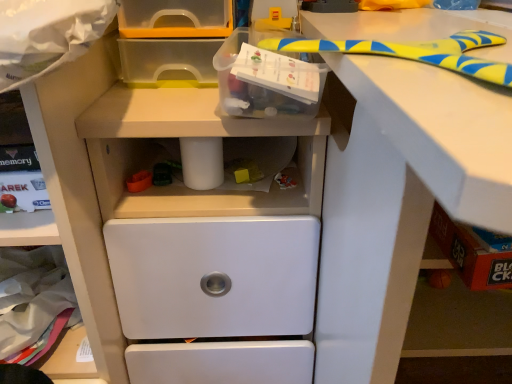
Question: Can you confirm if translucent plastic box at upper center is positioned to the left of white plastic workbench at center?

Choices:
 (A) yes
 (B) no

Answer: (B)

Question: Are translucent plastic box at upper center and white plastic workbench at center making contact?

Choices:
 (A) yes
 (B) no

Answer: (B)

Question: Does translucent plastic box at upper center turn towards white plastic workbench at center?

Choices:
 (A) no
 (B) yes

Answer: (A)

Question: Would you consider translucent plastic box at upper center to be distant from white plastic workbench at center?

Choices:
 (A) no
 (B) yes

Answer: (A)

Question: Considering the relative sizes of translucent plastic box at upper center and white plastic workbench at center in the image provided, is translucent plastic box at upper center wider than white plastic workbench at center?

Choices:
 (A) no
 (B) yes

Answer: (A)

Question: From the image's perspective, is white plastic workbench at center above or below white plastic drawer at lower center?

Choices:
 (A) above
 (B) below

Answer: (A)

Question: Is white plastic workbench at center in front of or behind white plastic drawer at lower center in the image?

Choices:
 (A) behind
 (B) front

Answer: (B)

Question: In the image, is white plastic workbench at center on the left side or the right side of white plastic drawer at lower center?

Choices:
 (A) right
 (B) left

Answer: (A)

Question: Which is correct: white plastic workbench at center is inside white plastic drawer at lower center, or outside of it?

Choices:
 (A) inside
 (B) outside

Answer: (B)

Question: From a real-world perspective, relative to white plastic drawer at lower center, is translucent plastic box at upper center vertically above or below?

Choices:
 (A) below
 (B) above

Answer: (B)

Question: In terms of width, does translucent plastic box at upper center look wider or thinner when compared to white plastic drawer at lower center?

Choices:
 (A) thin
 (B) wide

Answer: (A)

Question: Looking at the image, does translucent plastic box at upper center seem bigger or smaller compared to white plastic drawer at lower center?

Choices:
 (A) small
 (B) big

Answer: (A)

Question: Relative to white plastic drawer at lower center, is translucent plastic box at upper center in front or behind?

Choices:
 (A) front
 (B) behind

Answer: (A)

Question: In terms of width, does white plastic drawer at lower center look wider or thinner when compared to white plastic workbench at center?

Choices:
 (A) wide
 (B) thin

Answer: (B)

Question: Considering the relative positions of white plastic drawer at lower center and white plastic workbench at center in the image provided, is white plastic drawer at lower center to the left or to the right of white plastic workbench at center?

Choices:
 (A) left
 (B) right

Answer: (A)